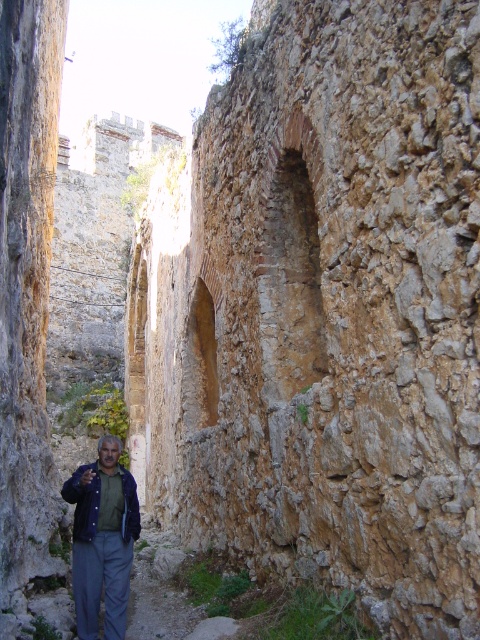
Is brown rough stone wall at center in front of blue denim jacket at lower left?

Yes.

In the scene shown: Which is more to the left, brown rough stone wall at center or blue denim jacket at lower left?

Positioned to the left is blue denim jacket at lower left.

Locate an element on the screen. This screenshot has height=640, width=480. brown rough stone wall at center is located at coordinates (324, 314).